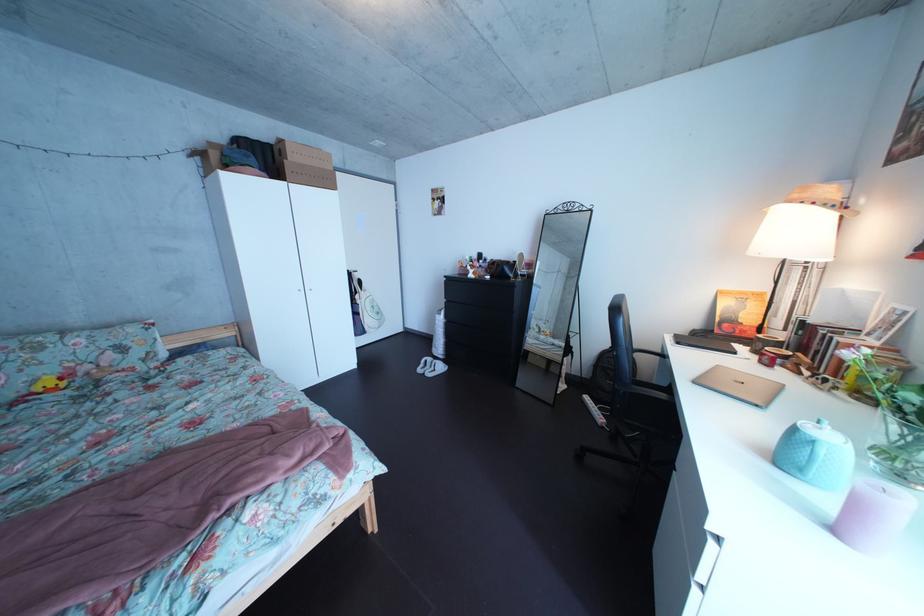
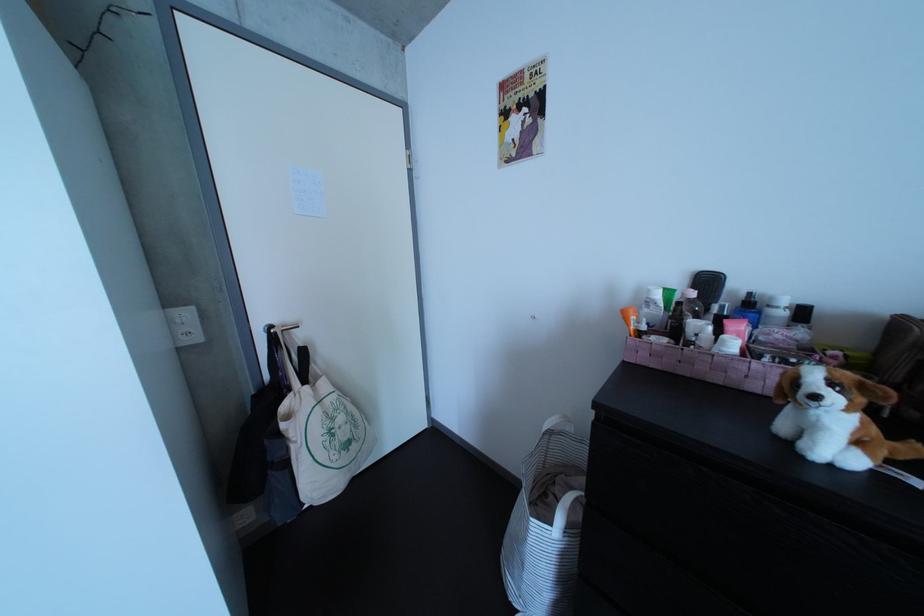
Question: In a continuous first-person perspective shot, in which direction is the camera moving?

Choices:
 (A) Left
 (B) Right
 (C) Forward
 (D) Backward

Answer: (C)